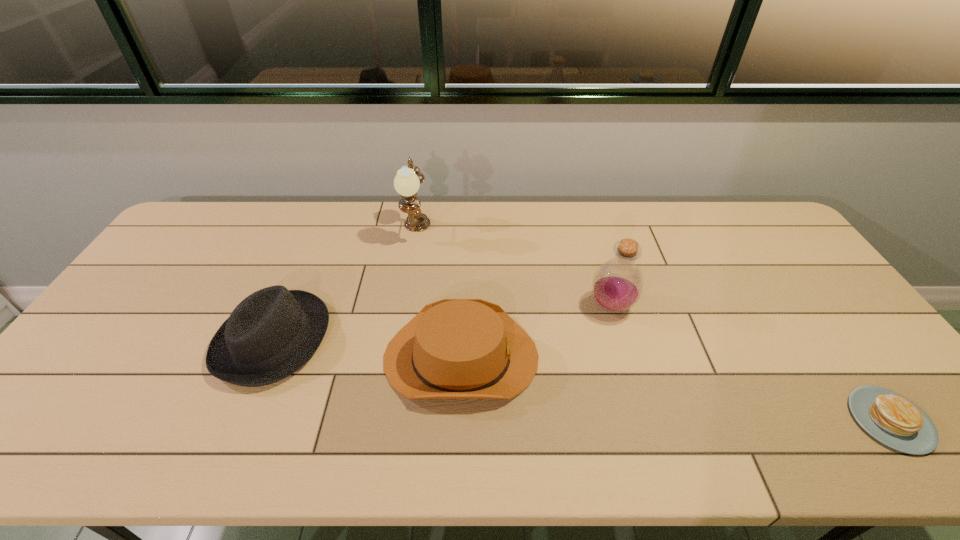
At what (x,y) coordinates should I click in order to perform the action: click on free space at the right edge. Please return your answer as a coordinate pair (x, y). The height and width of the screenshot is (540, 960). Looking at the image, I should click on (801, 264).

Locate an element on the screen. This screenshot has width=960, height=540. vacant region at the far left corner of the desktop is located at coordinates point(234,215).

Image resolution: width=960 pixels, height=540 pixels. I want to click on blank region between the second shortest object and the fedora, so click(x=367, y=348).

Locate an element on the screen. free space between the cowboy hat and the fedora is located at coordinates (367, 348).

This screenshot has width=960, height=540. I want to click on vacant space that is in between the fourth object from left to right and the fourth tallest object, so point(536,332).

Identify the location of free space that is in between the rightmost object and the tallest object. The image size is (960, 540). [653, 326].

What are the coordinates of `vacant area that lies between the fedora and the second shortest object` in the screenshot? It's located at (367, 348).

What are the coordinates of `vacant area that lies between the farthest object and the second object from right to left` in the screenshot? It's located at (514, 269).

I want to click on vacant point located between the second object from right to left and the cowboy hat, so click(x=536, y=332).

Find the location of `vacant region between the fourth tallest object and the second object from right to left`. vacant region between the fourth tallest object and the second object from right to left is located at coordinates (536, 332).